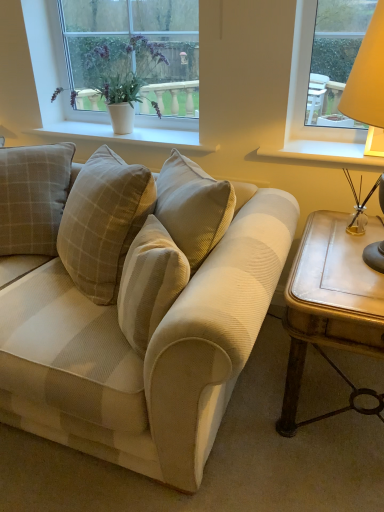
Question: Considering their positions, is matte yellow lampshade at right located in front of or behind beige corduroy couch at center?

Choices:
 (A) front
 (B) behind

Answer: (B)

Question: Considering the positions of matte yellow lampshade at right and beige corduroy couch at center in the image, is matte yellow lampshade at right bigger or smaller than beige corduroy couch at center?

Choices:
 (A) big
 (B) small

Answer: (B)

Question: Which is farther from the metallic gold table at right?

Choices:
 (A) white textured pot at upper center, marked as the first window sill in a left-to-right arrangement
 (B) beige corduroy couch at center
 (C) beige corduroy pillow at center
 (D) white painted wood at right, the 1th window sill viewed from the right
 (E) matte yellow lampshade at right

Answer: (C)

Question: Which object is positioned farthest from the white ceramic pot at upper left?

Choices:
 (A) white textured pot at upper center, which is counted as the second window sill, starting from the right
 (B) white ceramic pot at upper left
 (C) metallic gold table at right
 (D) beige corduroy couch at center
 (E) white painted wood at right, acting as the second window sill starting from the left

Answer: (C)